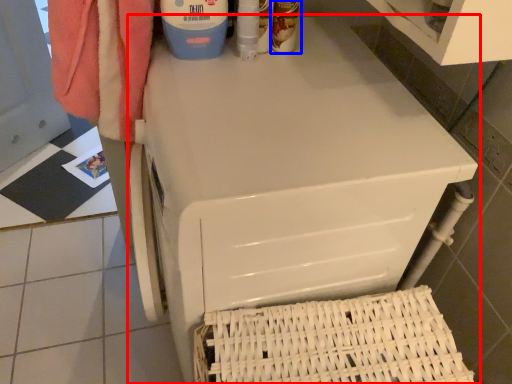
Question: Which of the following is the closest to the observer, home appliance (highlighted by a red box) or cleaning product (highlighted by a blue box)?

Choices:
 (A) home appliance
 (B) cleaning product

Answer: (A)